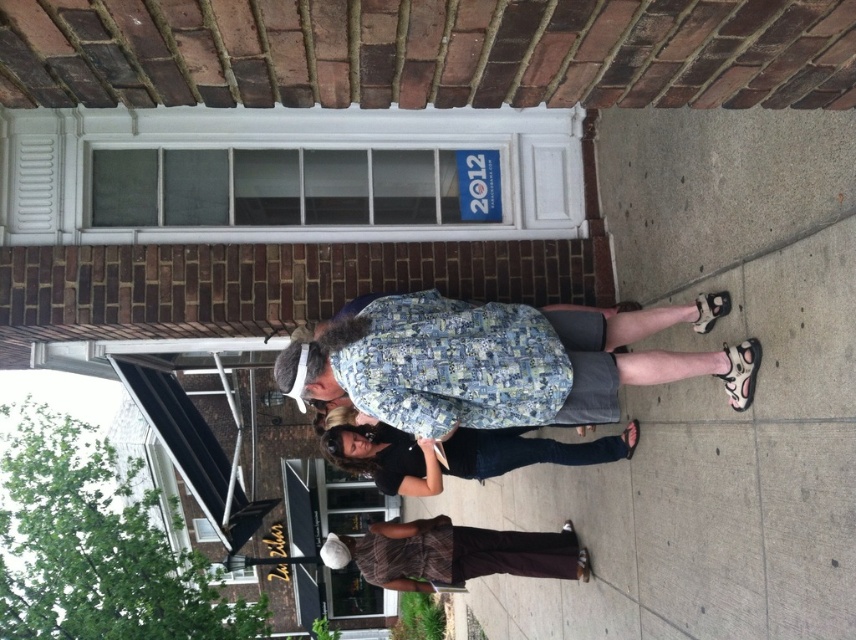
Between patterned fabric jacket at center and black denim jeans at center, which one is positioned higher?

patterned fabric jacket at center is above.

What do you see at coordinates (502, 362) in the screenshot?
I see `patterned fabric jacket at center` at bounding box center [502, 362].

Find the location of a particular element. This screenshot has height=640, width=856. patterned fabric jacket at center is located at coordinates (502, 362).